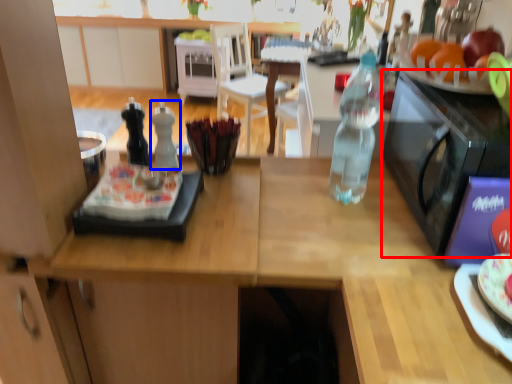
Question: Which object appears closest to the camera in this image, microwave oven (highlighted by a red box) or bottle (highlighted by a blue box)?

Choices:
 (A) microwave oven
 (B) bottle

Answer: (A)